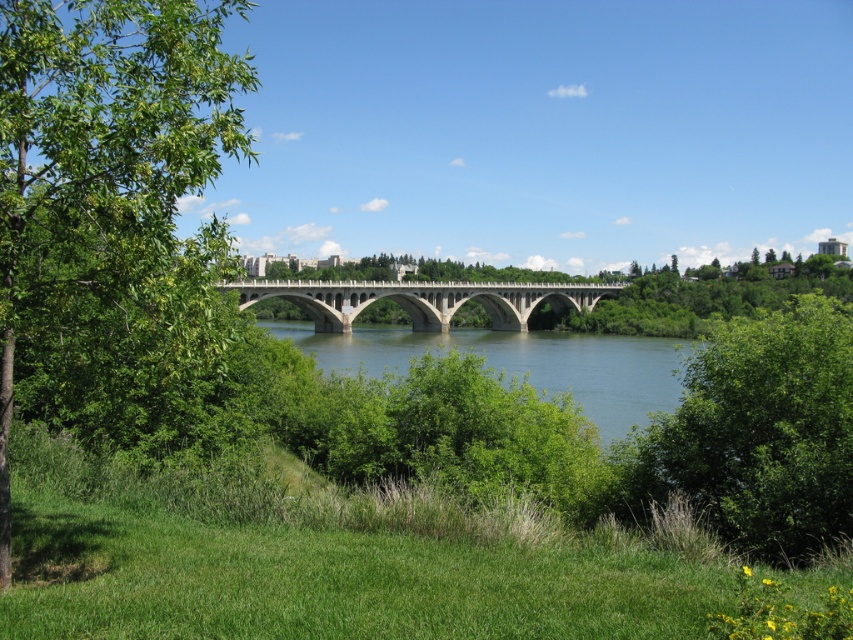
Describe the element at coordinates (521, 364) in the screenshot. I see `blue concrete bridge at center` at that location.

Who is higher up, blue concrete bridge at center or concrete bridge at center?

concrete bridge at center is above.

Where is `blue concrete bridge at center`? The width and height of the screenshot is (853, 640). blue concrete bridge at center is located at coordinates (521, 364).

Consider the image. Can you confirm if green leafy bush at right is wider than concrete bridge at center?

No.

Can you confirm if green leafy bush at right is smaller than concrete bridge at center?

Indeed, green leafy bush at right has a smaller size compared to concrete bridge at center.

Is point (747, 454) behind point (613, 284)?

No, it is in front of (613, 284).

Find the location of a particular element. green leafy bush at right is located at coordinates (759, 432).

Which of these two, green leafy tree at left or blue concrete bridge at center, stands taller?

green leafy tree at left is taller.

Can you confirm if green leafy tree at left is positioned above blue concrete bridge at center?

Indeed, green leafy tree at left is positioned over blue concrete bridge at center.

Locate an element on the screen. green leafy tree at left is located at coordinates (100, 148).